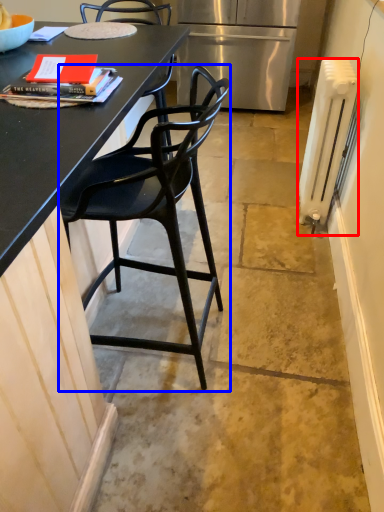
Question: Which of the following is the closest to the observer, radiator (highlighted by a red box) or chair (highlighted by a blue box)?

Choices:
 (A) radiator
 (B) chair

Answer: (B)